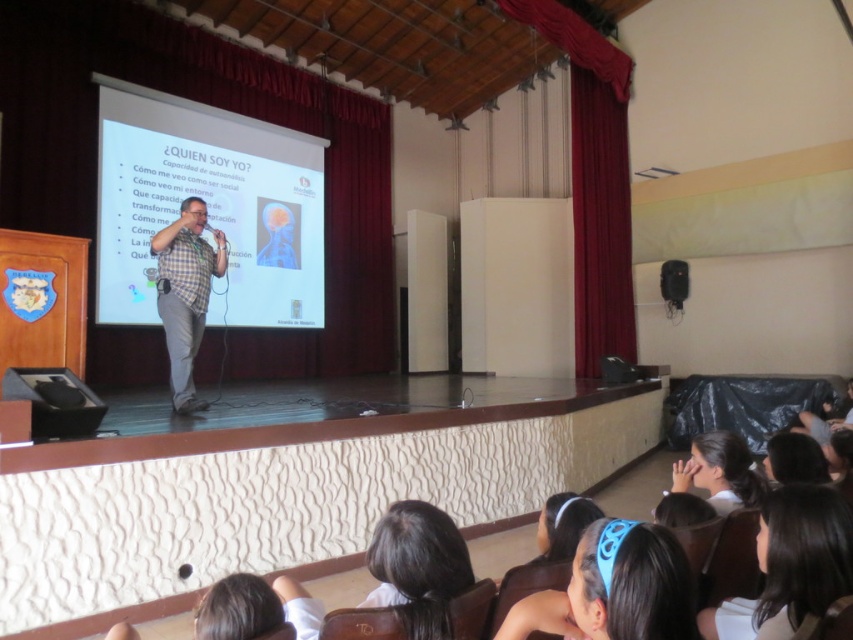
Between point (540, 625) and point (747, 477), which one is positioned behind?

Point (747, 477)

Is blue fabric headband at lower center wider than smooth white hair at lower right?

Yes.

Between point (618, 548) and point (738, 490), which one is positioned in front?

Point (618, 548)

Where is `blue fabric headband at lower center`? The height and width of the screenshot is (640, 853). blue fabric headband at lower center is located at coordinates (614, 589).

Is white matte projection screen at center to the left of blue fabric headband at lower center from the viewer's perspective?

Yes, white matte projection screen at center is to the left of blue fabric headband at lower center.

Is white matte projection screen at center to the right of blue fabric headband at lower center from the viewer's perspective?

No, white matte projection screen at center is not to the right of blue fabric headband at lower center.

Is point (233, 234) positioned after point (634, 545)?

Yes, point (233, 234) is behind point (634, 545).

At what (x,y) coordinates should I click in order to perform the action: click on white matte projection screen at center. Please return your answer as a coordinate pair (x, y). This screenshot has width=853, height=640. Looking at the image, I should click on (207, 209).

Measure the distance from smooth white hair at lower right to black matte speaker at upper right.

smooth white hair at lower right is 6.53 meters from black matte speaker at upper right.

What do you see at coordinates (720, 472) in the screenshot? I see `smooth white hair at lower right` at bounding box center [720, 472].

Which is behind, point (730, 432) or point (683, 291)?

The point (683, 291) is more distant.

Locate an element on the screen. This screenshot has width=853, height=640. smooth white hair at lower right is located at coordinates (720, 472).